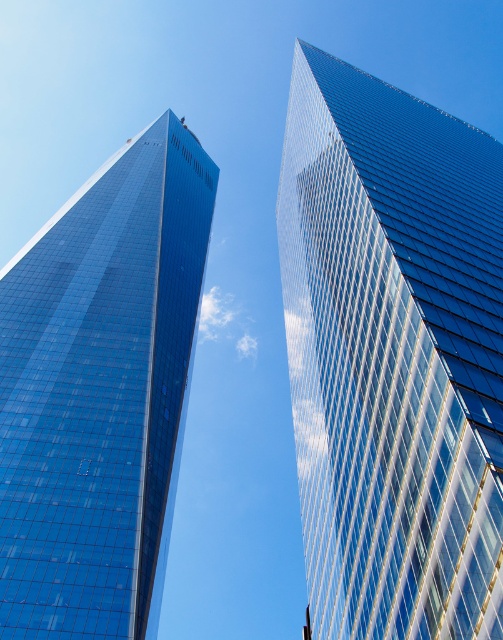
Question: Considering the relative positions of transparent glass skyscraper at upper center and shiny glass skyscraper at left in the image provided, where is transparent glass skyscraper at upper center located with respect to shiny glass skyscraper at left?

Choices:
 (A) right
 (B) left

Answer: (A)

Question: Among these points, which one is farthest from the camera?

Choices:
 (A) (480, 426)
 (B) (86, 276)

Answer: (B)

Question: Does transparent glass skyscraper at upper center have a smaller size compared to shiny glass skyscraper at left?

Choices:
 (A) no
 (B) yes

Answer: (A)

Question: Which object appears farthest from the camera in this image?

Choices:
 (A) shiny glass skyscraper at left
 (B) transparent glass skyscraper at upper center

Answer: (A)

Question: Is transparent glass skyscraper at upper center thinner than shiny glass skyscraper at left?

Choices:
 (A) no
 (B) yes

Answer: (A)